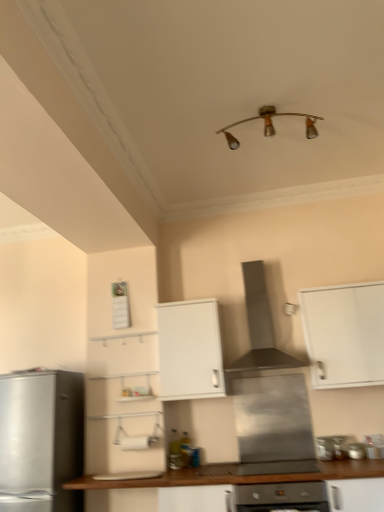
Question: Is metallic silver stove at lower center, which is counted as the 1th appliance, starting from the right, outside white matte cabinet at center, the 2th cabinetry in the right-to-left sequence?

Choices:
 (A) yes
 (B) no

Answer: (A)

Question: Is metallic silver stove at lower center, which is counted as the 1th appliance, starting from the right, at the left side of white matte cabinet at center, which ranks as the 1th cabinetry in left-to-right order?

Choices:
 (A) yes
 (B) no

Answer: (B)

Question: Is metallic silver stove at lower center, which is counted as the 1th appliance, starting from the right, thinner than white matte cabinet at center, which ranks as the 1th cabinetry in left-to-right order?

Choices:
 (A) yes
 (B) no

Answer: (A)

Question: Considering the relative sizes of metallic silver stove at lower center, the 3th appliance in the left-to-right sequence, and white matte cabinet at center, the 2th cabinetry in the right-to-left sequence, in the image provided, is metallic silver stove at lower center, the 3th appliance in the left-to-right sequence, shorter than white matte cabinet at center, the 2th cabinetry in the right-to-left sequence,?

Choices:
 (A) no
 (B) yes

Answer: (B)

Question: Can you confirm if metallic silver stove at lower center, the 3th appliance in the left-to-right sequence, is taller than white matte cabinet at center, which ranks as the 1th cabinetry in left-to-right order?

Choices:
 (A) no
 (B) yes

Answer: (A)

Question: Is point (345, 438) closer or farther from the camera than point (322, 438)?

Choices:
 (A) farther
 (B) closer

Answer: (B)

Question: Do you think metallic silver stove at lower center, the 3th appliance in the left-to-right sequence, is within metallic silver stove at lower center, which is the 2th appliance from right to left, or outside of it?

Choices:
 (A) inside
 (B) outside

Answer: (B)

Question: Considering the relative positions of metallic silver stove at lower center, the 3th appliance in the left-to-right sequence, and metallic silver stove at lower center, which is the 2th appliance from right to left, in the image provided, is metallic silver stove at lower center, the 3th appliance in the left-to-right sequence, to the left or to the right of metallic silver stove at lower center, which is the 2th appliance from right to left,?

Choices:
 (A) right
 (B) left

Answer: (A)

Question: From a real-world perspective, is metallic silver stove at lower center, which is counted as the 1th appliance, starting from the right, physically located above or below metallic silver stove at lower center, which ranks as the second appliance in left-to-right order?

Choices:
 (A) above
 (B) below

Answer: (A)

Question: Considering the positions of point (243, 434) and point (377, 355), is point (243, 434) closer or farther from the camera than point (377, 355)?

Choices:
 (A) closer
 (B) farther

Answer: (B)

Question: Based on their positions, is stainless steel range hood at center, placed as the 1th appliance when sorted from left to right, located to the left or right of white matte cabinet at upper right, positioned as the first cabinetry in right-to-left order?

Choices:
 (A) left
 (B) right

Answer: (A)

Question: Considering the positions of stainless steel range hood at center, placed as the 1th appliance when sorted from left to right, and white matte cabinet at upper right, positioned as the first cabinetry in right-to-left order, in the image, is stainless steel range hood at center, placed as the 1th appliance when sorted from left to right, taller or shorter than white matte cabinet at upper right, positioned as the first cabinetry in right-to-left order,?

Choices:
 (A) short
 (B) tall

Answer: (A)

Question: Is stainless steel range hood at center, the 3th appliance viewed from the right, inside or outside of white matte cabinet at upper right, which appears as the 2th cabinetry when viewed from the left?

Choices:
 (A) outside
 (B) inside

Answer: (A)

Question: Is point (294, 486) positioned closer to the camera than point (344, 451)?

Choices:
 (A) closer
 (B) farther

Answer: (A)

Question: Looking at the image, does satin silver oven at center seem bigger or smaller compared to metallic silver stove at lower center, the 3th appliance in the left-to-right sequence?

Choices:
 (A) big
 (B) small

Answer: (A)